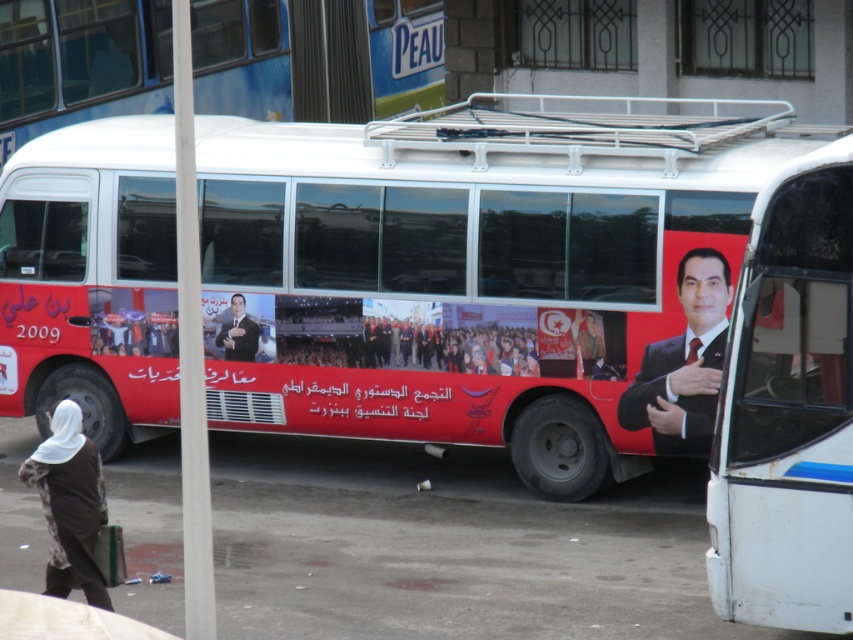
You are a pedestrian standing in front of the white matte bus at right and the smooth suit at right. Which object is located to the right of the other?

The white matte bus at right is positioned on the right side of smooth suit at right.

You are a pedestrian standing in front of the white matte bus at right and the smooth suit at right. Which object is wider?

The smooth suit at right is wider than the white matte bus at right.

You are standing at the point labeled point [708,426] and want to walk to the point labeled point [250,353]. Which direction should you face to walk directly towards your destination?

You should face towards the lower left direction because point [250,353] is located lower and to the left relative to point [708,426].